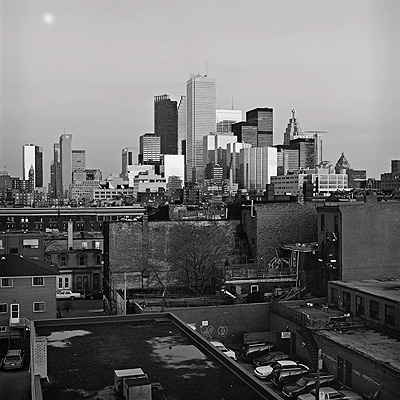
You are a GUI agent. You are given a task and a screenshot of the screen. Output one action in this format:
    pyautogui.click(x=<x>, y=<y>)
    Task: Click on the windows
    The height and width of the screenshot is (400, 400).
    Given the screenshot: What is the action you would take?
    pyautogui.click(x=37, y=282), pyautogui.click(x=37, y=306), pyautogui.click(x=5, y=282), pyautogui.click(x=2, y=308), pyautogui.click(x=4, y=329)